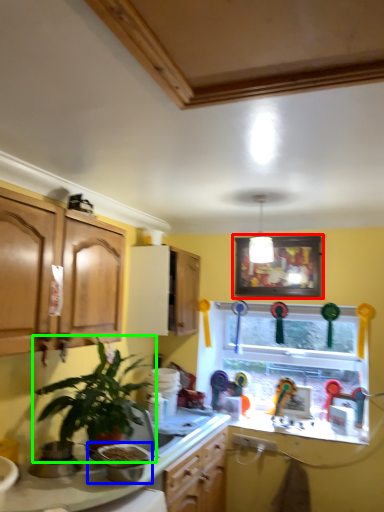
Question: Which is nearer to the picture frame (highlighted by a red box)? appliance (highlighted by a blue box) or houseplant (highlighted by a green box).

Choices:
 (A) appliance
 (B) houseplant

Answer: (B)